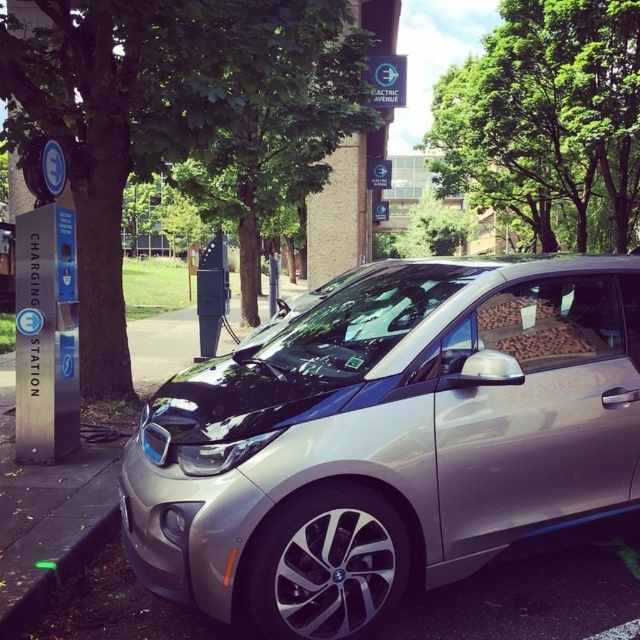
You are a delivery driver who needs to park your truck, which is 2 meters wide, in this parking lot. You see the sleek metallic car at center and the green leafy tree at center. Can your truck fit between them without touching either?

The sleek metallic car at center has a lesser width compared to green leafy tree at center. Since your truck is 2 meters wide, it depends on the available space between them. However, the description only mentions the car is narrower than the tree, not the distance between them. Therefore, we cannot determine if the truck can fit based on the provided information.

You are standing at the point labeled point (118,17) and want to walk to point (19,627). Which direction should you move in to get there?

You should move towards the right and away from the viewer to reach point (19,627) from point (118,17).